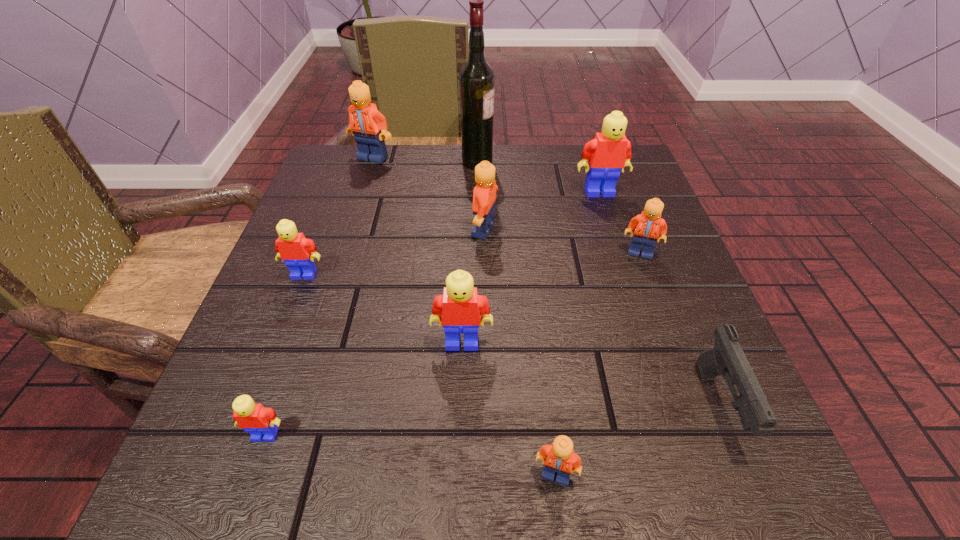
Identify the location of vacant space at the far right corner of the desktop. (606, 202).

Where is `vacant space at the near right corner of the desktop`? vacant space at the near right corner of the desktop is located at coordinates (720, 450).

At what (x,y) coordinates should I click in order to perform the action: click on free point between the rightmost orange Lego and the biggest orange Lego. Please return your answer as a coordinate pair (x, y). This screenshot has height=540, width=960. Looking at the image, I should click on (507, 205).

Locate an element on the screen. Image resolution: width=960 pixels, height=540 pixels. free spot between the second farthest yellow Lego and the pistol is located at coordinates (512, 340).

This screenshot has height=540, width=960. Identify the location of vacant area that lies between the farthest Lego and the pistol. (545, 281).

I want to click on vacant space in between the seventh nearest Lego and the third biggest orange Lego, so click(619, 222).

I want to click on empty location between the seventh farthest Lego and the nearest Lego, so 411,454.

Find the location of a particular element. free space between the seventh farthest object and the rightmost orange Lego is located at coordinates (551, 297).

Identify which object is located as the eighth nearest to the third yellow Lego from left to right. Please provide its 2D coordinates. Your answer should be formatted as a tuple, i.e. [(x, y)], where the tuple contains the x and y coordinates of a point satisfying the conditions above.

[(476, 79)]

Identify the location of the sixth closest object to the rightmost yellow Lego. (369, 127).